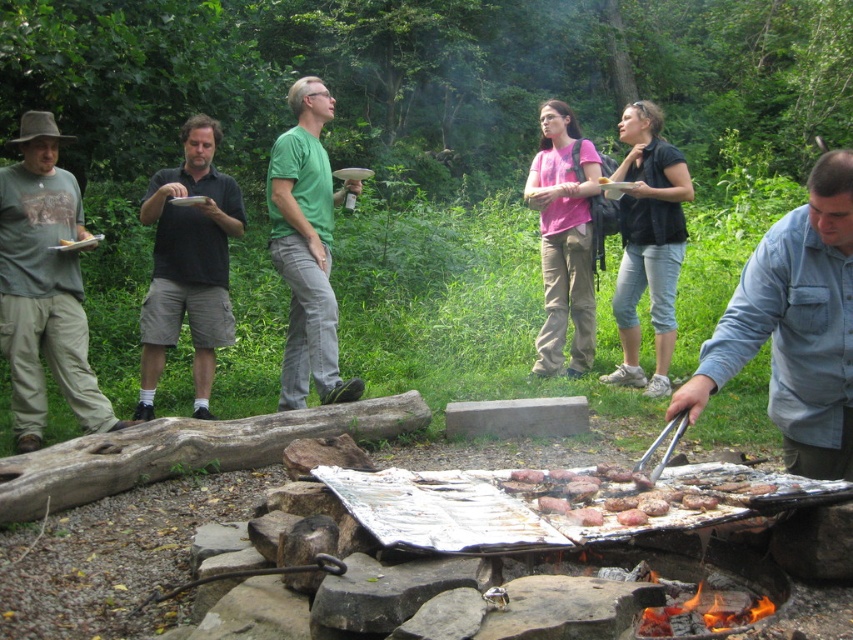
Question: Is matte gray shirt at left to the right of brown matte meat at center from the viewer's perspective?

Choices:
 (A) no
 (B) yes

Answer: (A)

Question: Among these points, which one is nearest to the camera?

Choices:
 (A) (548, 504)
 (B) (27, 285)
 (C) (160, 268)

Answer: (A)

Question: Which of the following is the farthest from the observer?

Choices:
 (A) (45, 276)
 (B) (782, 230)
 (C) (691, 497)

Answer: (A)

Question: Which point appears farthest from the camera in this image?

Choices:
 (A) (270, 234)
 (B) (212, 241)
 (C) (701, 497)
 (D) (27, 355)

Answer: (A)

Question: Does denim shirt at right appear over brown matte meat at center?

Choices:
 (A) no
 (B) yes

Answer: (B)

Question: Is denim shirt at right bigger than matte gray shirt at left?

Choices:
 (A) yes
 (B) no

Answer: (B)